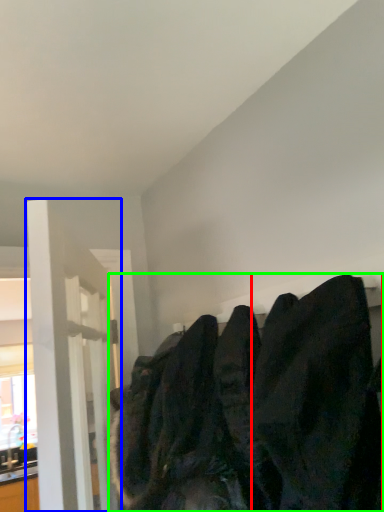
Question: Which object is positioned farthest from clothing (highlighted by a red box)? Select from door (highlighted by a blue box) and sweatshirt (highlighted by a green box).

Choices:
 (A) door
 (B) sweatshirt

Answer: (A)